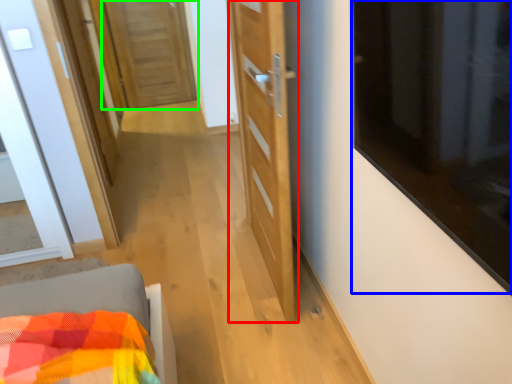
Question: Considering the real-world distances, which object is farthest from door (highlighted by a red box)? window (highlighted by a blue box) or door (highlighted by a green box)?

Choices:
 (A) window
 (B) door

Answer: (B)